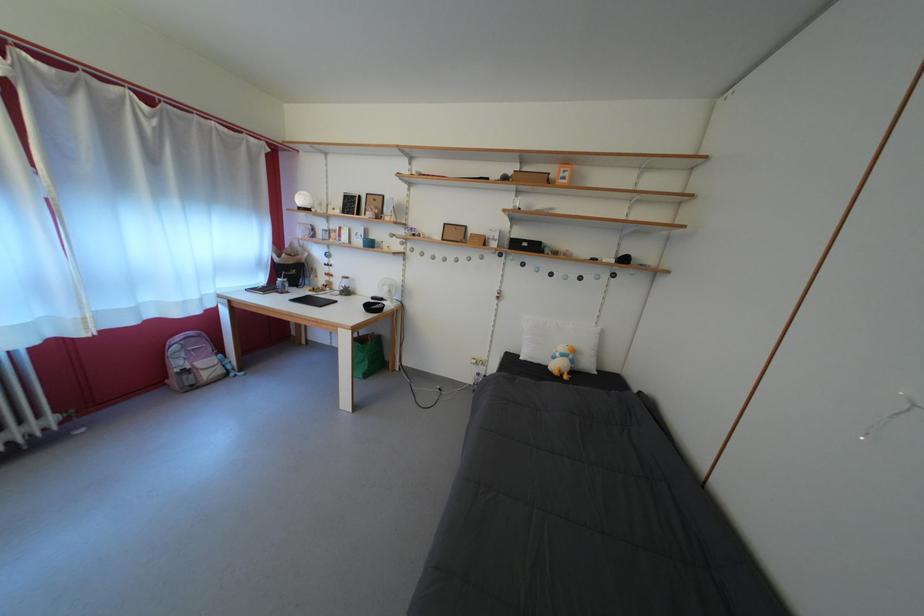
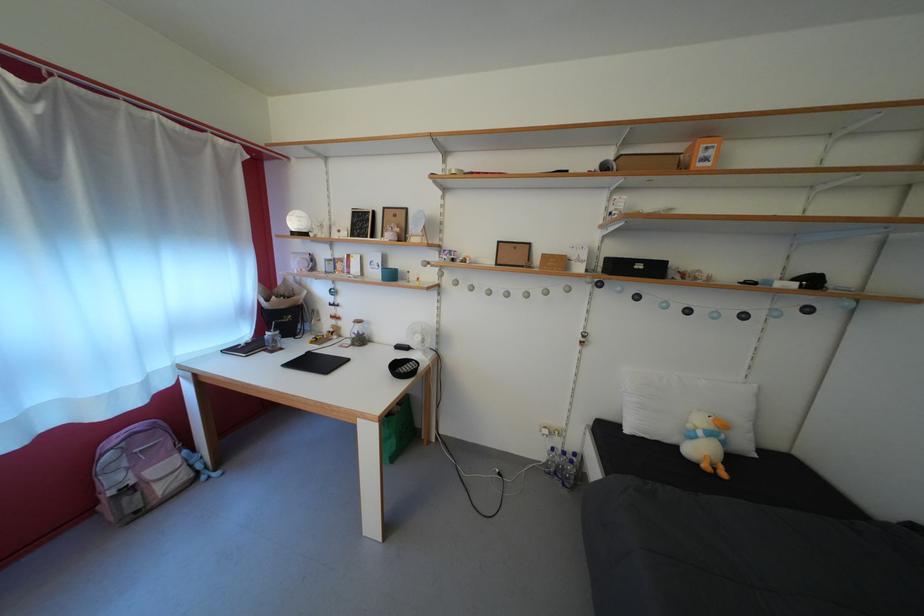
The point at (347, 290) is marked in the first image. Where is the corresponding point in the second image?

(358, 334)